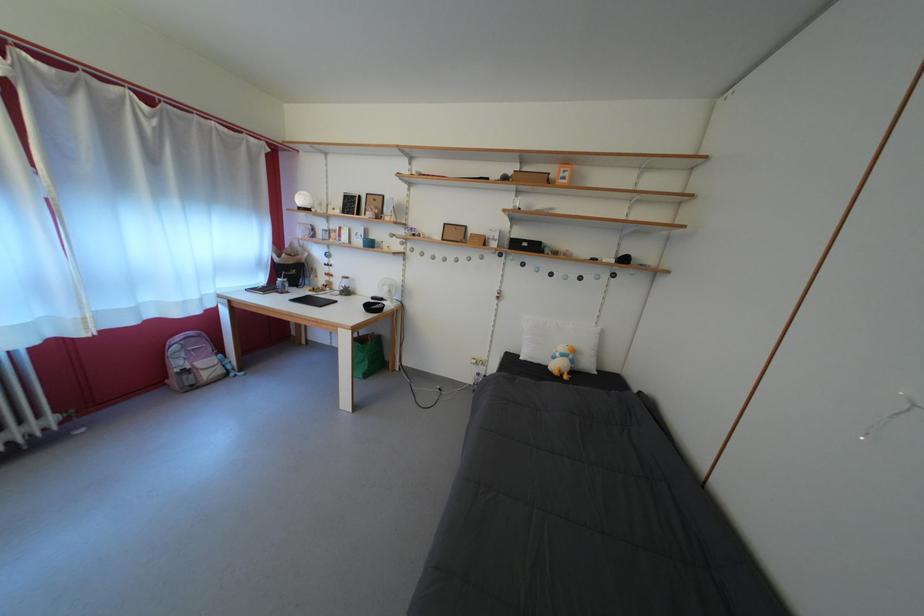
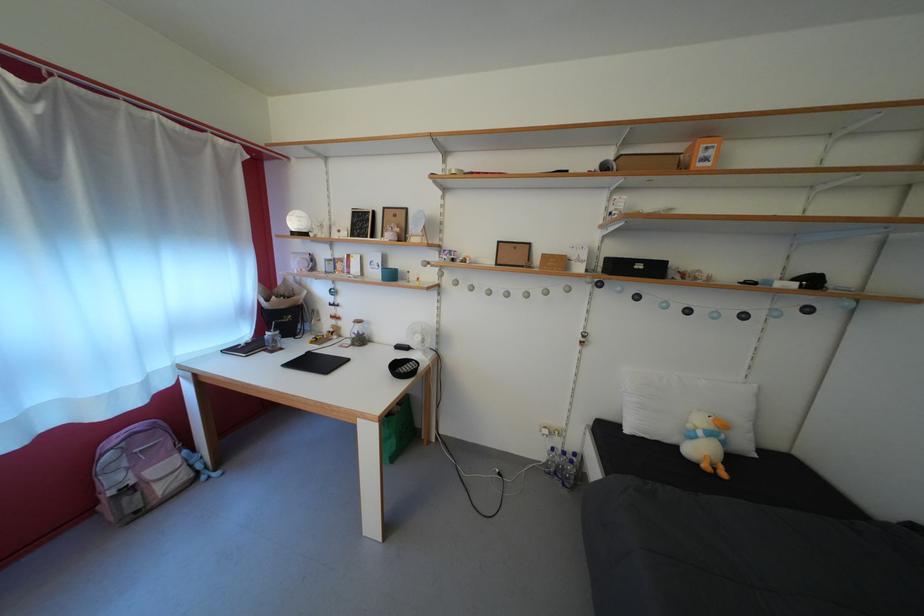
The point at (347, 290) is marked in the first image. Where is the corresponding point in the second image?

(358, 334)